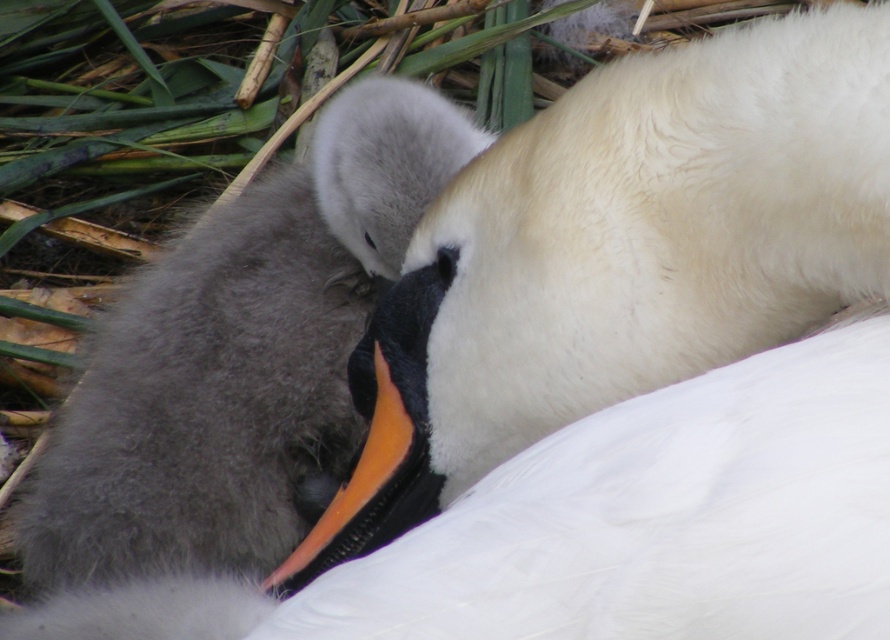
Question: Is white soft swan at center positioned in front of soft gray down at left?

Choices:
 (A) yes
 (B) no

Answer: (A)

Question: Which point appears farthest from the camera in this image?

Choices:
 (A) (666, 288)
 (B) (373, 264)
 (C) (330, 515)

Answer: (B)

Question: Which of the following is the closest to the observer?

Choices:
 (A) soft gray down at left
 (B) white soft swan at center
 (C) orange glossy beak at center

Answer: (B)

Question: Which of the following is the farthest from the observer?

Choices:
 (A) orange glossy beak at center
 (B) white soft swan at center

Answer: (A)

Question: Does white soft swan at center appear under soft gray down at left?

Choices:
 (A) yes
 (B) no

Answer: (A)

Question: Can you confirm if white soft swan at center is wider than soft gray down at left?

Choices:
 (A) no
 (B) yes

Answer: (B)